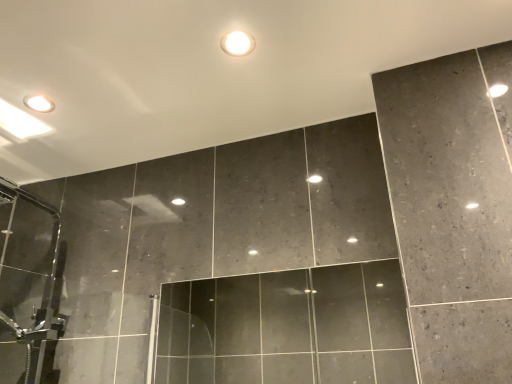
Question: Is transparent glass door at center bigger or smaller than matte white droplight at upper center?

Choices:
 (A) big
 (B) small

Answer: (A)

Question: In the image, is transparent glass door at center on the left side or the right side of matte white droplight at upper center?

Choices:
 (A) left
 (B) right

Answer: (B)

Question: Which of these objects is positioned farthest from the transparent glass door at center?

Choices:
 (A) dark gray marble wall at upper center
 (B) matte white droplight at upper center

Answer: (B)

Question: Which is nearer to the dark gray marble wall at upper center?

Choices:
 (A) matte white droplight at upper center
 (B) transparent glass door at center

Answer: (A)